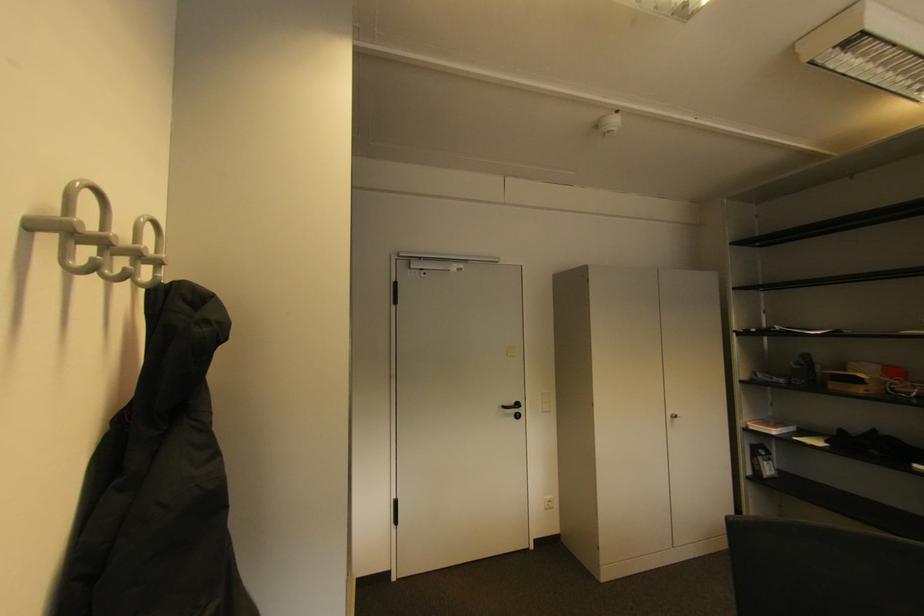
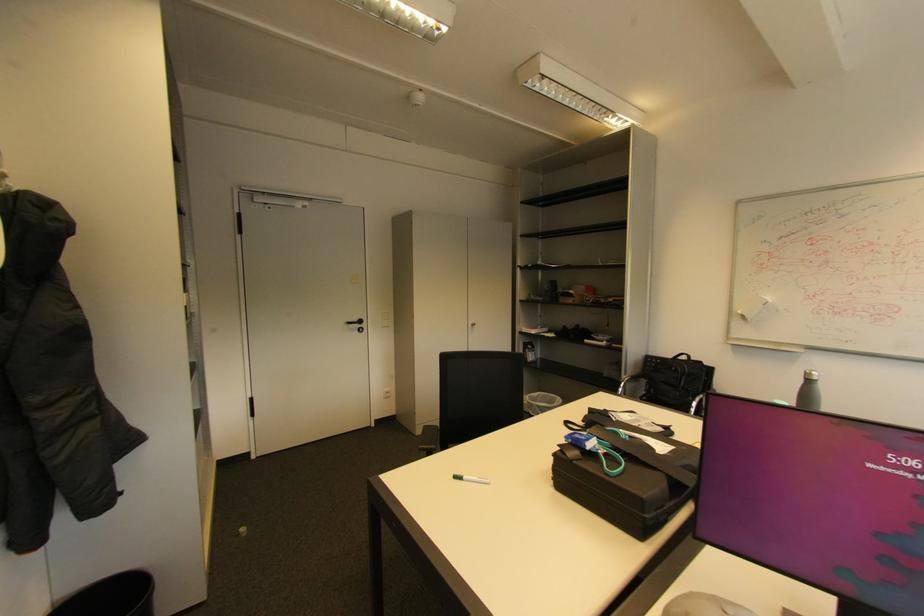
What movement of the cameraman would produce the second image?

The movement direction of the cameraman is right, backward.